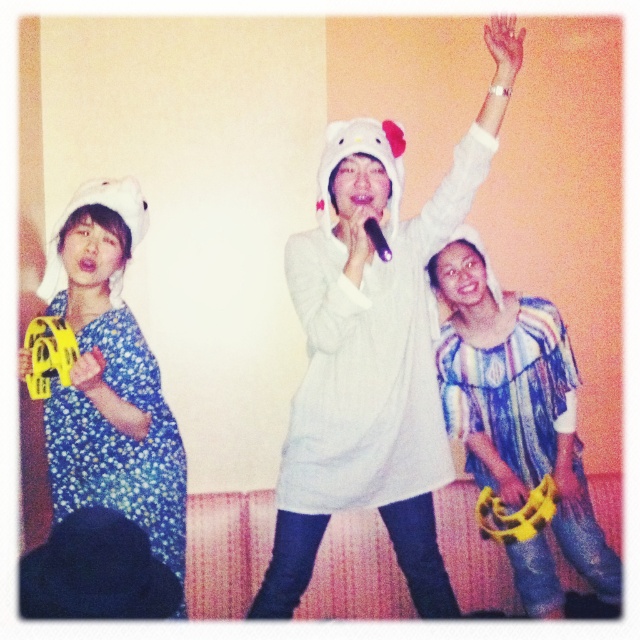
Question: Which point is farther to the camera?

Choices:
 (A) (392, 310)
 (B) (508, 461)
 (C) (64, 435)

Answer: (B)

Question: Which point appears closest to the camera in this image?

Choices:
 (A) (504, 465)
 (B) (419, 268)

Answer: (B)

Question: Can you confirm if striped cotton dress at center is positioned below floral fabric dress at left?

Choices:
 (A) no
 (B) yes

Answer: (B)

Question: Is striped cotton dress at center to the right of floral fabric dress at left from the viewer's perspective?

Choices:
 (A) no
 (B) yes

Answer: (B)

Question: Can you confirm if white plush hello kitty hat at center is positioned to the left of striped cotton dress at center?

Choices:
 (A) yes
 (B) no

Answer: (A)

Question: Which object is positioned closest to the white plush hello kitty hat at center?

Choices:
 (A) floral fabric dress at left
 (B) striped cotton dress at center

Answer: (B)